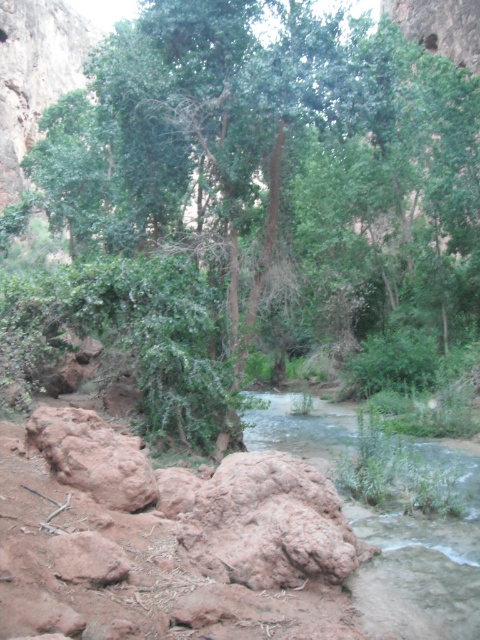
You are standing at the origin point of the coordinate system in this scene. You want to walk to the green leafy tree at center. What are the coordinates you need to move to reach it?

The coordinates to reach the green leafy tree at center are at point [261,189].

You are navigating a small drone that needs to fly from the starting point to the destination point in the scene. The drone must avoid obstacles like rocks and vegetation. Given the coordinates of the two points, which point should you start from to ensure a safer flight path? Please choose between point (478,198) and point (456,620).

You should start from point (456,620) because point (478,198) is behind it, meaning the drone might encounter more obstacles like rocks and vegetation when starting from the latter.

You are a hiker who needs to cross the stream. You have a 30 feet long rope. You see the green leafy tree at center and the clear water at center. Can you safely use the rope to cross the stream between these two points?

The distance between the green leafy tree at center and the clear water at center is 37.64 feet. Since the rope is only 30 feet long, it is not long enough to safely span the gap between them. You would need a longer rope to make the crossing safely.